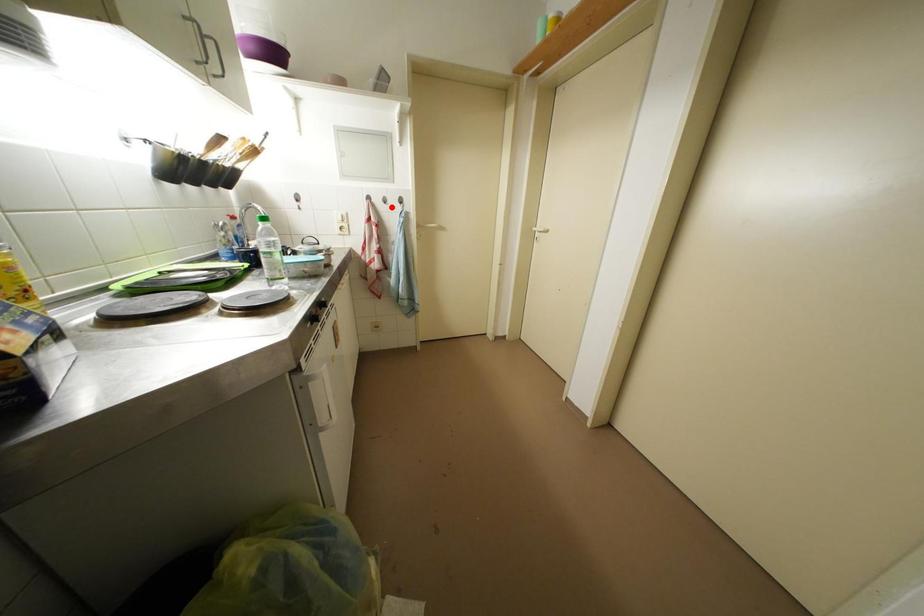
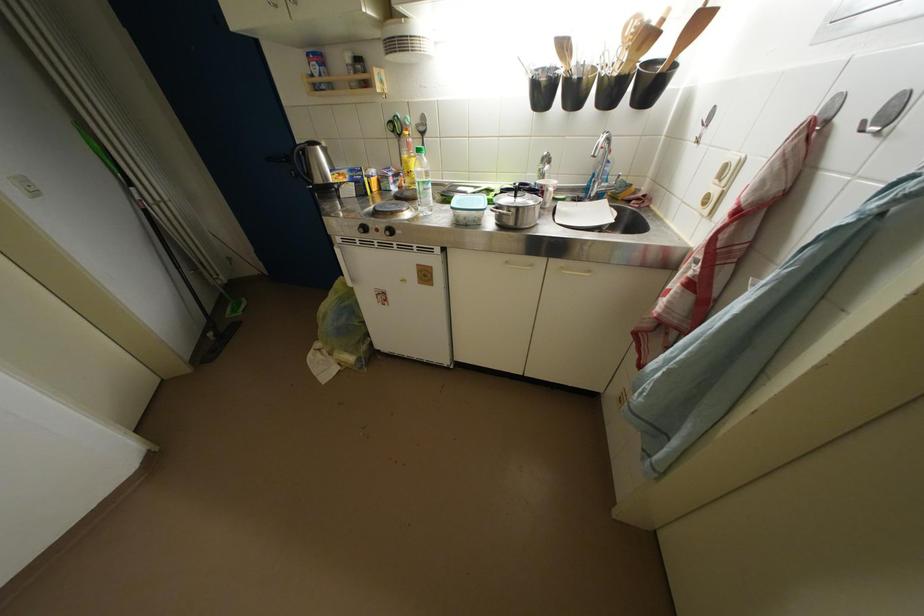
Find the pixel in the second image that matches the highlighted location in the first image.

(869, 132)